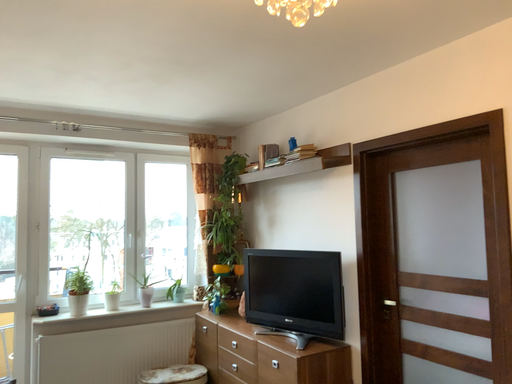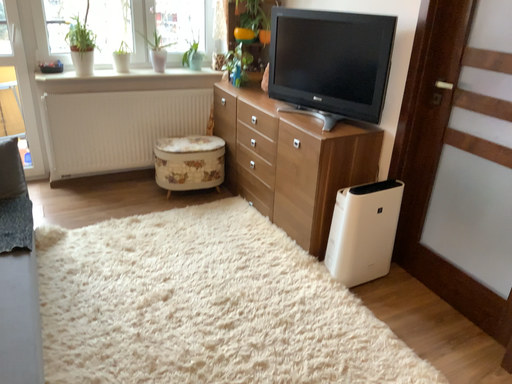
Question: How did the camera likely rotate when shooting the video?

Choices:
 (A) rotated upward
 (B) rotated downward

Answer: (B)